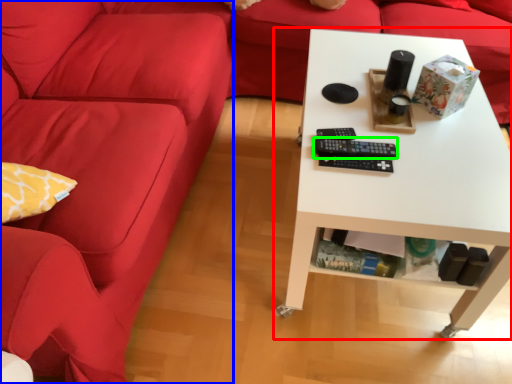
Question: Which object is positioned farthest from table (highlighted by a red box)? Select from studio couch (highlighted by a blue box) and control (highlighted by a green box).

Choices:
 (A) studio couch
 (B) control

Answer: (A)